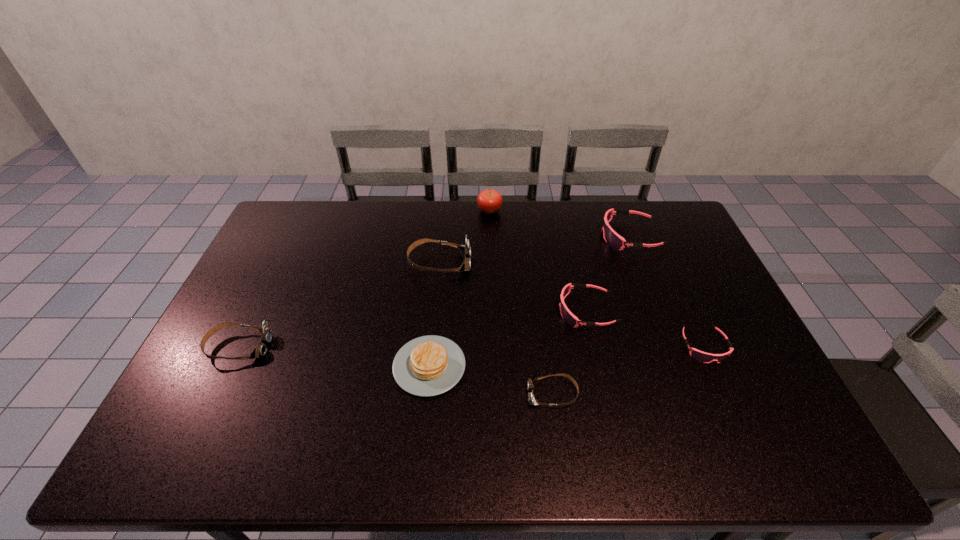
Locate an element on the screen. This screenshot has height=540, width=960. the nearest goggles is located at coordinates coord(531,382).

Image resolution: width=960 pixels, height=540 pixels. Find the location of `the rightmost brown goggles`. the rightmost brown goggles is located at coordinates (531, 382).

What are the coordinates of `free space located on the front of the fourth object from left to right` in the screenshot? It's located at (492, 288).

This screenshot has height=540, width=960. Find the location of `free spot located 0.370m on the front-facing side of the biggest pink goggles`. free spot located 0.370m on the front-facing side of the biggest pink goggles is located at coordinates (497, 237).

Locate an element on the screen. The width and height of the screenshot is (960, 540). vacant area situated on the front-facing side of the biggest pink goggles is located at coordinates (570, 237).

I want to click on vacant area situated 0.280m on the front-facing side of the biggest pink goggles, so click(523, 237).

The image size is (960, 540). I want to click on vacant space located on the front-facing side of the farthest brown goggles, so click(x=513, y=262).

You are a GUI agent. You are given a task and a screenshot of the screen. Output one action in this format:
    pyautogui.click(x=<x>, y=<y>)
    Task: Click on the vacant area situated 0.180m on the front-facing side of the second smallest pink goggles
    The height and width of the screenshot is (540, 960).
    Given the screenshot: What is the action you would take?
    pyautogui.click(x=498, y=311)

Identify the location of free region located 0.080m on the front-facing side of the second smallest pink goggles. Image resolution: width=960 pixels, height=540 pixels. point(532,311).

This screenshot has height=540, width=960. Identify the location of vacant space located 0.290m on the front-facing side of the second smallest pink goggles. (462, 311).